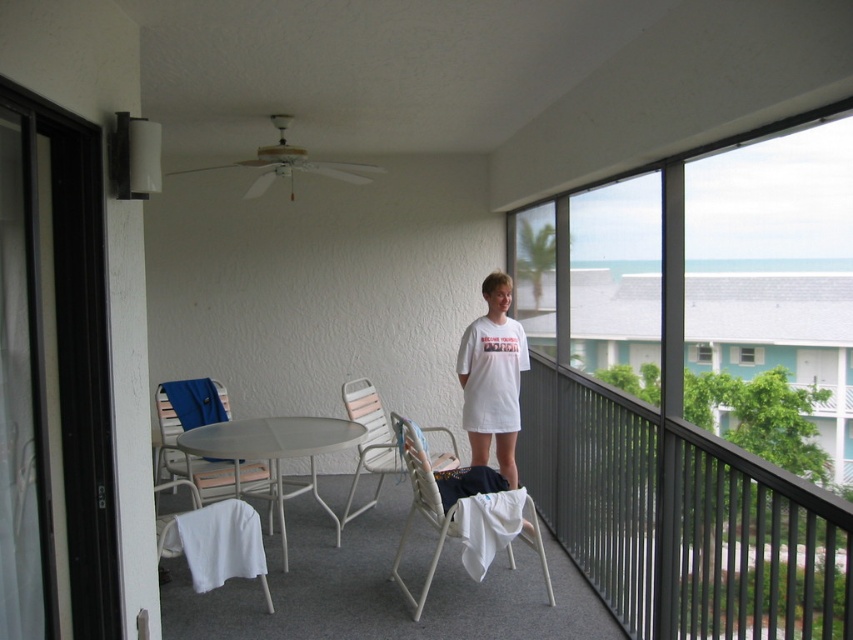
Between white plastic chairs at center and white plastic chair at center, which one is positioned higher?

white plastic chair at center is higher up.

Looking at this image, who is more distant from viewer, [573,426] or [442,460]?

The point [442,460] is more distant.

Where is `white plastic chairs at center`? The width and height of the screenshot is (853, 640). white plastic chairs at center is located at coordinates (680, 518).

Who is positioned more to the right, white plastic chair at lower left or white plastic chair at center?

white plastic chair at center

From the picture: Who is more distant from viewer, (x=170, y=444) or (x=440, y=429)?

The point (x=170, y=444) is more distant.

Is point (231, 464) positioned in front of point (396, 442)?

No, it is behind (396, 442).

This screenshot has height=640, width=853. I want to click on white plastic chair at lower left, so (x=192, y=428).

Who is taller, white plastic chairs at center or white metal table at center?

white plastic chairs at center is taller.

Does white plastic chairs at center appear on the left side of white metal table at center?

In fact, white plastic chairs at center is to the right of white metal table at center.

Between point (595, 557) and point (213, 451), which one is positioned in front?

Point (595, 557) is in front.

At what (x,y) coordinates should I click in order to perform the action: click on white plastic chairs at center. Please return your answer as a coordinate pair (x, y). This screenshot has height=640, width=853. Looking at the image, I should click on (680, 518).